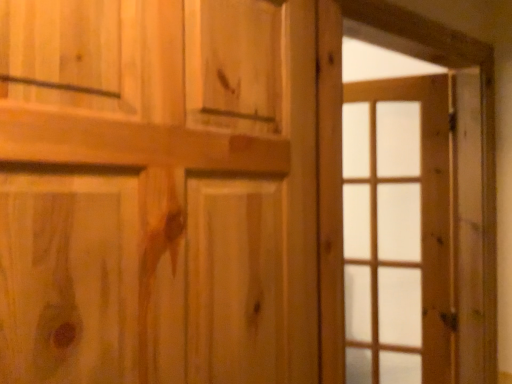
Question: Would you say wooden barn door at right is part of natural wood door at center's contents?

Choices:
 (A) yes
 (B) no

Answer: (B)

Question: Considering the relative sizes of natural wood door at center and wooden barn door at right in the image provided, is natural wood door at center shorter than wooden barn door at right?

Choices:
 (A) no
 (B) yes

Answer: (B)

Question: Is natural wood door at center closer to the viewer compared to wooden barn door at right?

Choices:
 (A) yes
 (B) no

Answer: (A)

Question: Can you confirm if natural wood door at center is bigger than wooden barn door at right?

Choices:
 (A) no
 (B) yes

Answer: (B)

Question: From the image's perspective, is natural wood door at center located beneath wooden barn door at right?

Choices:
 (A) yes
 (B) no

Answer: (B)

Question: From a real-world perspective, is natural wood door at center located higher than wooden barn door at right?

Choices:
 (A) yes
 (B) no

Answer: (A)

Question: Would you say wooden barn door at right is a long distance from clear glass door at right?

Choices:
 (A) yes
 (B) no

Answer: (B)

Question: Is clear glass door at right completely or partially inside wooden barn door at right?

Choices:
 (A) no
 (B) yes

Answer: (A)

Question: From a real-world perspective, is wooden barn door at right physically below clear glass door at right?

Choices:
 (A) yes
 (B) no

Answer: (B)

Question: From the image's perspective, is wooden barn door at right beneath clear glass door at right?

Choices:
 (A) yes
 (B) no

Answer: (B)

Question: Considering the relative sizes of wooden barn door at right and clear glass door at right in the image provided, is wooden barn door at right shorter than clear glass door at right?

Choices:
 (A) yes
 (B) no

Answer: (A)

Question: Does wooden barn door at right have a larger size compared to clear glass door at right?

Choices:
 (A) no
 (B) yes

Answer: (B)

Question: Are wooden barn door at right and natural wood door at center far apart?

Choices:
 (A) yes
 (B) no

Answer: (B)